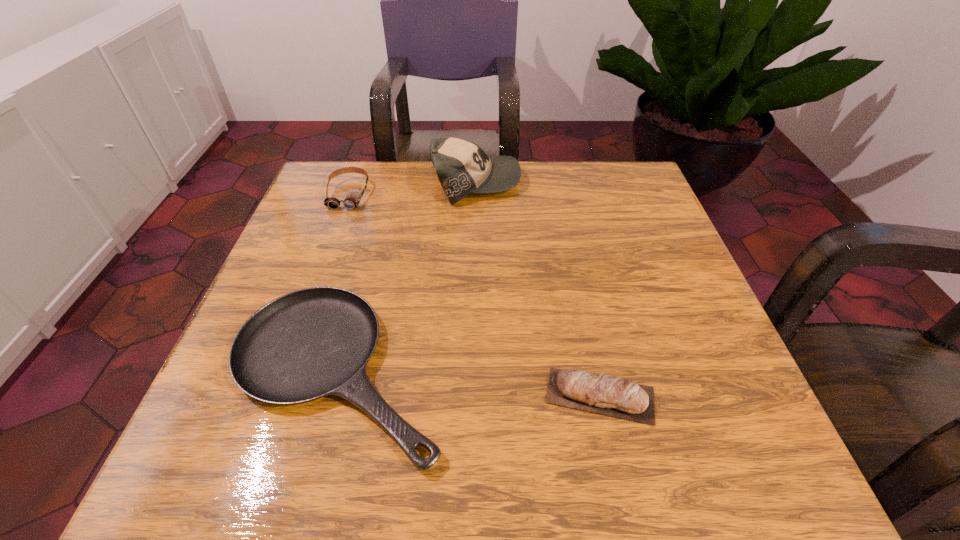
You are a GUI agent. You are given a task and a screenshot of the screen. Output one action in this format:
    pyautogui.click(x=<x>, y=<y>)
    Task: Click on the tallest object
    Image resolution: width=960 pixels, height=540 pixels.
    Given the screenshot: What is the action you would take?
    pyautogui.click(x=463, y=168)

What are the coordinates of `goggles` in the screenshot? It's located at (352, 200).

This screenshot has width=960, height=540. I want to click on the rightmost object, so pyautogui.click(x=613, y=396).

Locate an element on the screen. Image resolution: width=960 pixels, height=540 pixels. frying pan is located at coordinates (307, 344).

The width and height of the screenshot is (960, 540). I want to click on vacant space positioned 0.180m on the front-facing side of the baseball cap, so 590,182.

You are a GUI agent. You are given a task and a screenshot of the screen. Output one action in this format:
    pyautogui.click(x=<x>, y=<y>)
    Task: Click on the free space located on the front-facing side of the goggles
    
    Given the screenshot: What is the action you would take?
    pyautogui.click(x=319, y=276)

The width and height of the screenshot is (960, 540). Find the location of `free space located on the back of the pita bread`. free space located on the back of the pita bread is located at coordinates (567, 245).

The width and height of the screenshot is (960, 540). In order to click on vacant space located 0.120m on the right of the shortest object in this screenshot , I will do `click(520, 370)`.

Find the location of a particular element. The image size is (960, 540). baseball cap situated at the far edge is located at coordinates (463, 168).

The height and width of the screenshot is (540, 960). What are the coordinates of `goggles located at the far edge` in the screenshot? It's located at (352, 200).